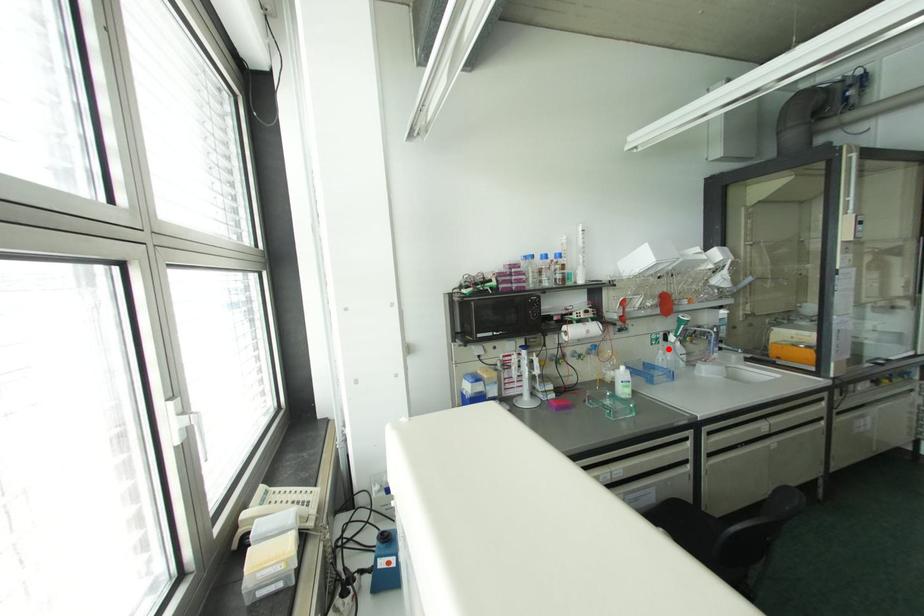
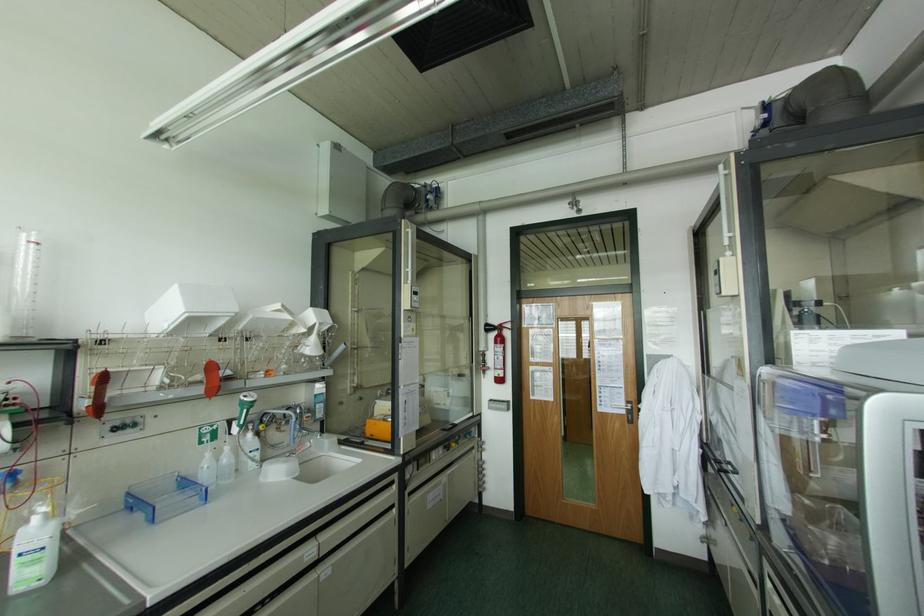
Question: A red point is marked in image1. In image2, is the corresponding 3D point closer to the camera or farther? Reply with the corresponding letter.

Choices:
 (A) The corresponding 3D point is closer.
 (B) The corresponding 3D point is farther.

Answer: (A)